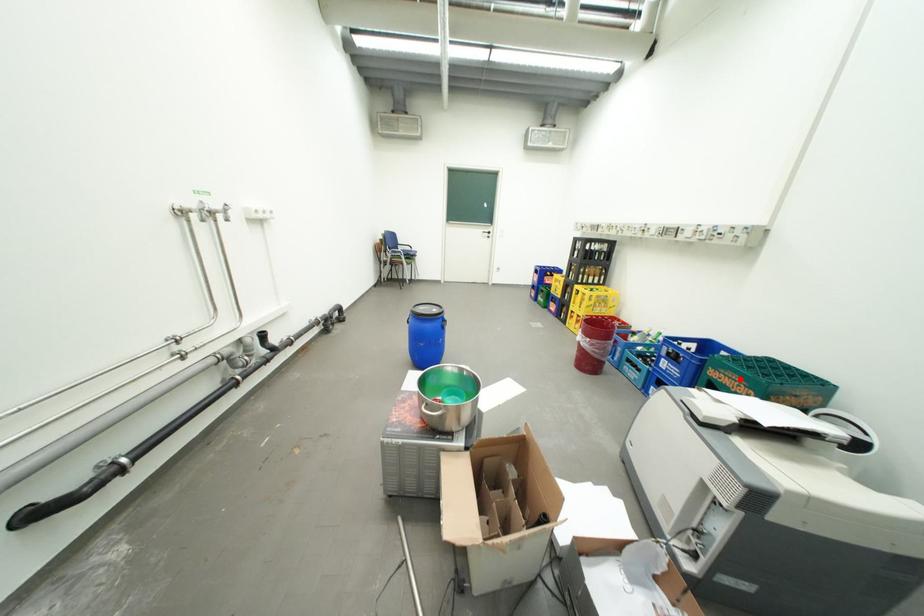
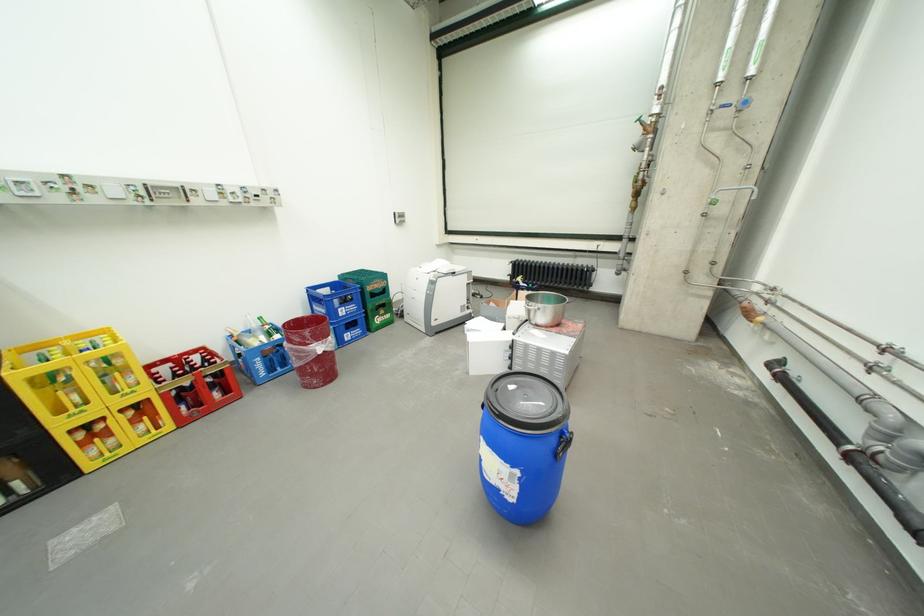
Locate, in the second image, the point that corresponds to the highlighted location in the first image.

(386, 285)